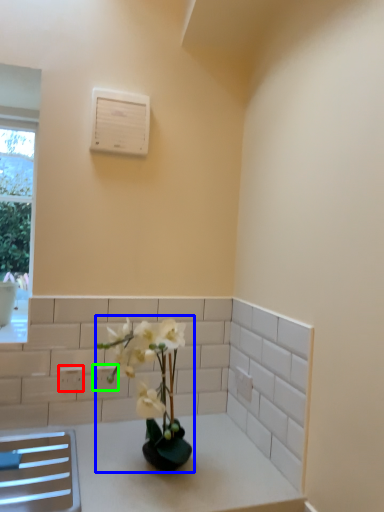
Question: Which object is positioned closest to electric outlet (highlighted by a red box)? Select from houseplant (highlighted by a blue box) and electric outlet (highlighted by a green box).

Choices:
 (A) houseplant
 (B) electric outlet

Answer: (B)